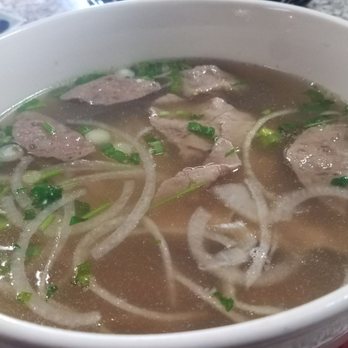
In order to click on lip of bowl in this screenshot , I will do `click(10, 323)`, `click(81, 343)`, `click(170, 345)`, `click(247, 333)`, `click(292, 318)`, `click(340, 300)`.